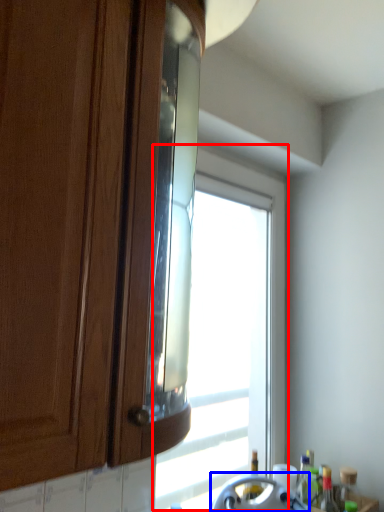
Question: Which point is closer to the camera, window (highlighted by a red box) or appliance (highlighted by a blue box)?

Choices:
 (A) window
 (B) appliance

Answer: (B)